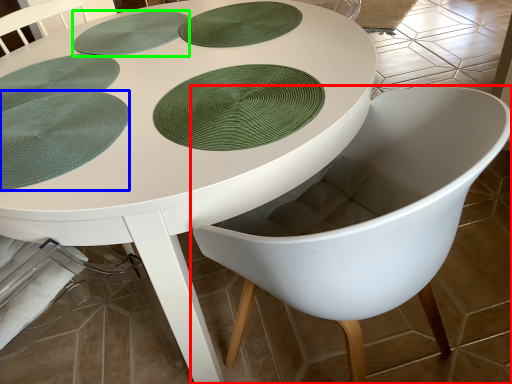
Question: Considering the real-world distances, which object is farthest from chair (highlighted by a red box)? paper plate (highlighted by a blue box) or platter (highlighted by a green box)?

Choices:
 (A) paper plate
 (B) platter

Answer: (B)